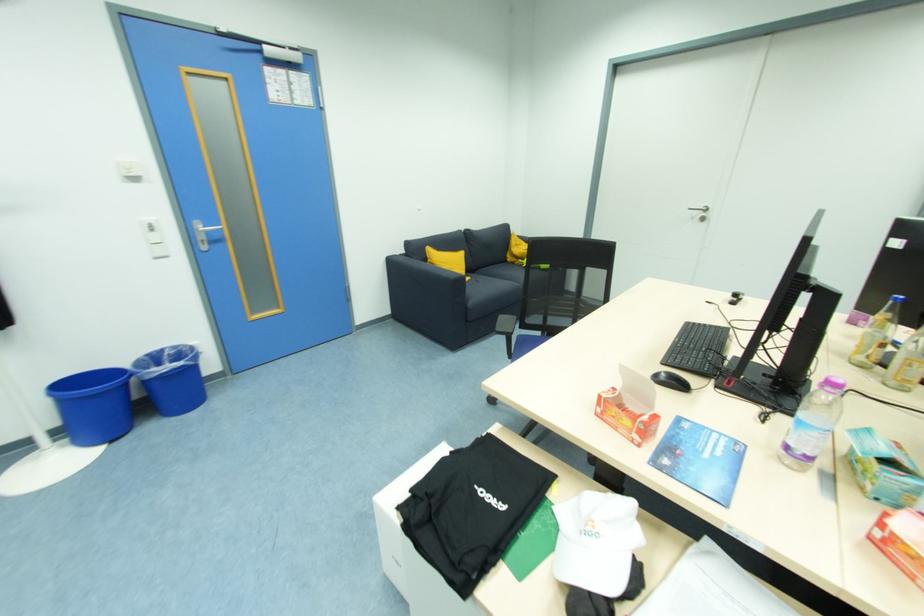
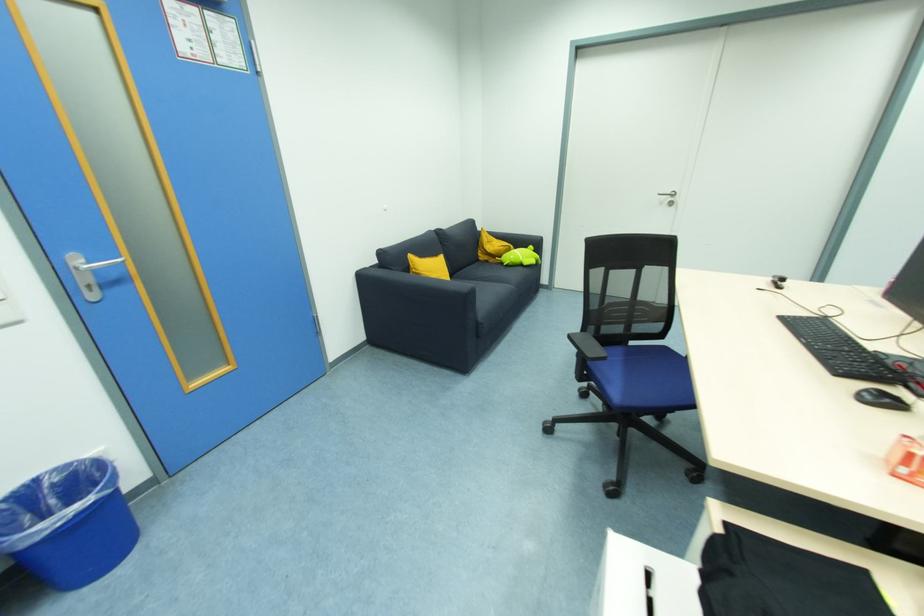
From the picture: The images are taken continuously from a first-person perspective. In which direction are you moving?

The cameraman walked toward left, forward.